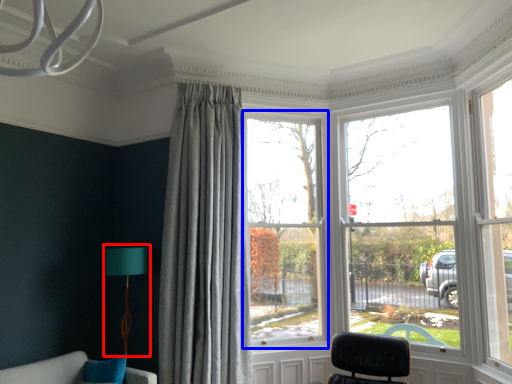
Question: Among these objects, which one is nearest to the camera, table lamp (highlighted by a red box) or window (highlighted by a blue box)?

Choices:
 (A) table lamp
 (B) window

Answer: (A)